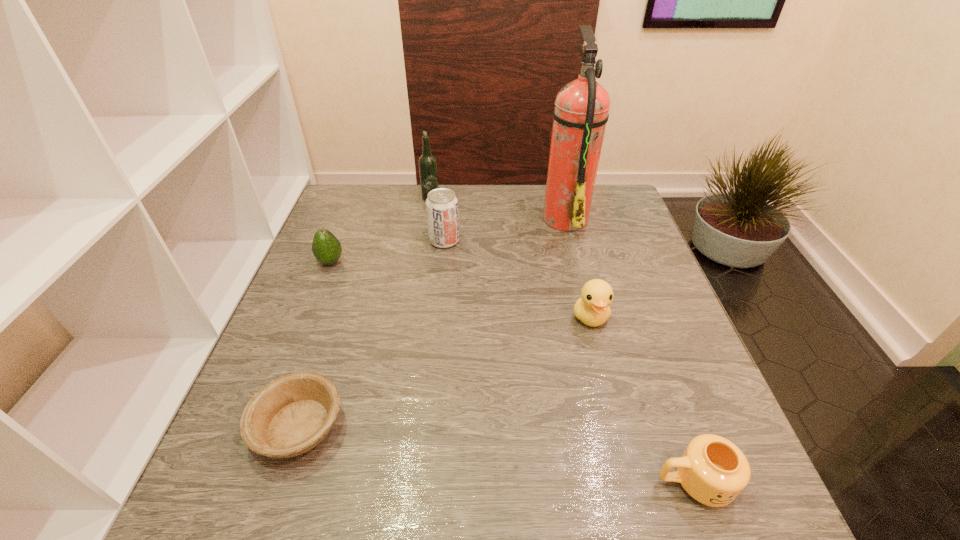
You are a GUI agent. You are given a task and a screenshot of the screen. Output one action in this format:
    pyautogui.click(x=<x>, y=<y>)
    Task: Click on the free spot located on the front of the beer bottle
    The width and height of the screenshot is (960, 540).
    Given the screenshot: What is the action you would take?
    pyautogui.click(x=421, y=255)

Find the location of a particular element. The image size is (960, 540). free space located on the right of the soda can is located at coordinates (604, 241).

Image resolution: width=960 pixels, height=540 pixels. What are the coordinates of `vacant space located on the face of the third nearest object` in the screenshot? It's located at (618, 428).

This screenshot has width=960, height=540. Identify the location of vacant area located on the right of the avocado. (447, 262).

Where is `free space located 0.110m on the handle side of the mug`? The width and height of the screenshot is (960, 540). free space located 0.110m on the handle side of the mug is located at coordinates (589, 482).

This screenshot has height=540, width=960. I want to click on free space located 0.110m on the handle side of the mug, so click(589, 482).

Locate an element on the screen. blank space located on the handle side of the mug is located at coordinates (529, 482).

This screenshot has width=960, height=540. I want to click on free space located 0.070m on the right of the bowl, so click(x=383, y=427).

Where is `fire extinguisher that is at the far edge`? fire extinguisher that is at the far edge is located at coordinates (581, 112).

You are a GUI agent. You are given a task and a screenshot of the screen. Output one action in this format:
    pyautogui.click(x=<x>, y=<y>)
    Task: Click on the beer bottle situated at the far edge
    The width and height of the screenshot is (960, 540).
    Given the screenshot: What is the action you would take?
    pyautogui.click(x=427, y=162)